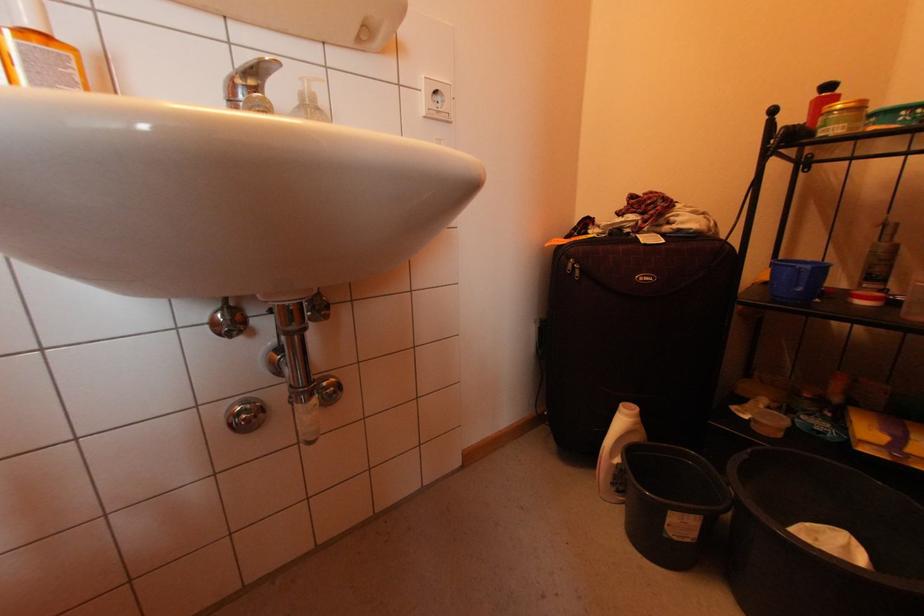
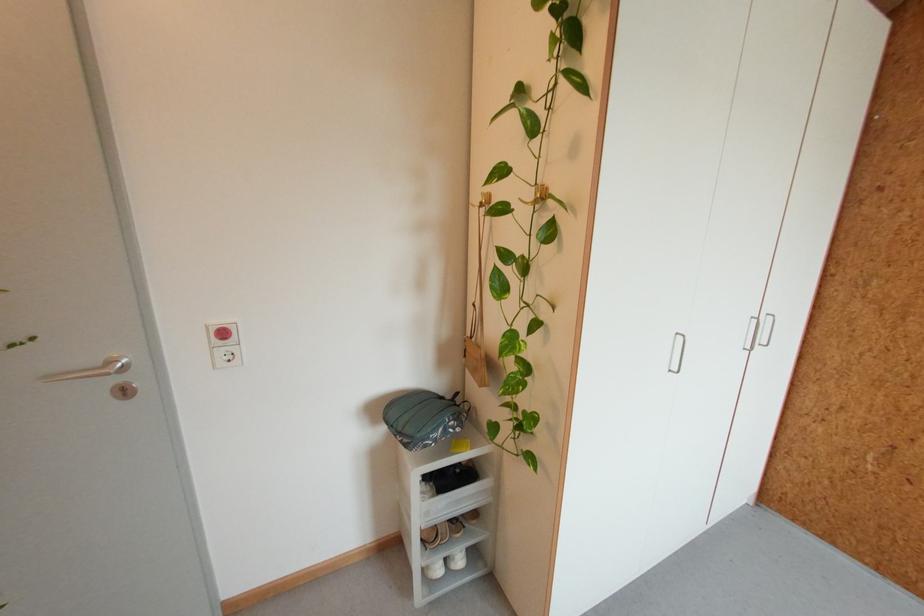
The images are taken continuously from a first-person perspective. In which direction are you moving?

The cameraman walked toward left, backward.